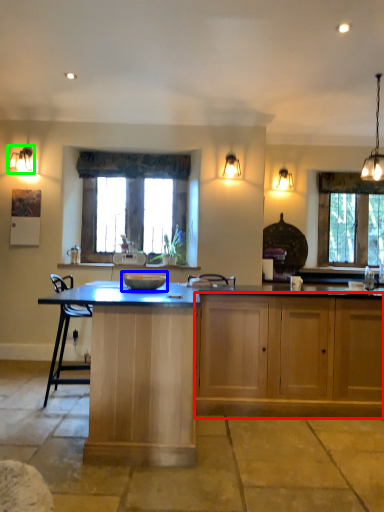
Question: Based on their relative distances, which object is farther from cabinetry (highlighted by a red box)? Choose from bowl (highlighted by a blue box) and lamp (highlighted by a green box).

Choices:
 (A) bowl
 (B) lamp

Answer: (B)